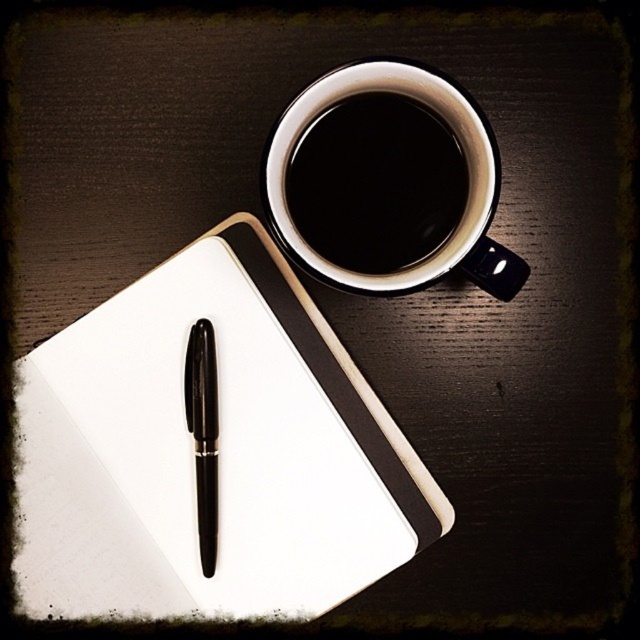
Can you confirm if white matte notepad at upper left is smaller than black glossy mug at upper center?

Incorrect, white matte notepad at upper left is not smaller in size than black glossy mug at upper center.

Where is `white matte notepad at upper left`? This screenshot has width=640, height=640. white matte notepad at upper left is located at coordinates (216, 452).

Is black glossy mug at upper center smaller than black glossy pen at center?

No.

Who is more distant from viewer, (330, 221) or (209, 372)?

Point (209, 372)

At what (x,y) coordinates should I click in order to perform the action: click on black glossy mug at upper center. Please return your answer as a coordinate pair (x, y). Image resolution: width=640 pixels, height=640 pixels. Looking at the image, I should click on (376, 182).

Identify the location of black ceramic mug at upper center. (387, 182).

Is point (403, 145) positioned behind point (212, 468)?

That is False.

Find the location of a particular element. This screenshot has height=640, width=640. black ceramic mug at upper center is located at coordinates (387, 182).

Locate an element on the screen. Image resolution: width=640 pixels, height=640 pixels. black ceramic mug at upper center is located at coordinates (387, 182).